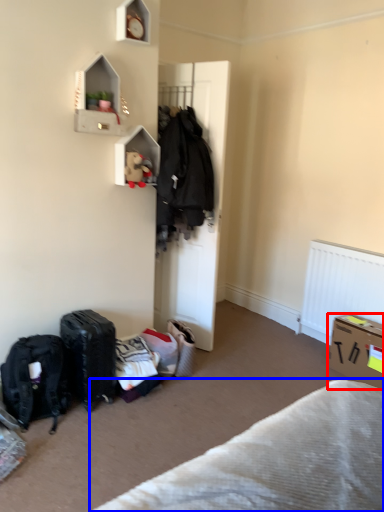
Question: Which object appears farthest to the camera in this image, box (highlighted by a red box) or furniture (highlighted by a blue box)?

Choices:
 (A) box
 (B) furniture

Answer: (A)